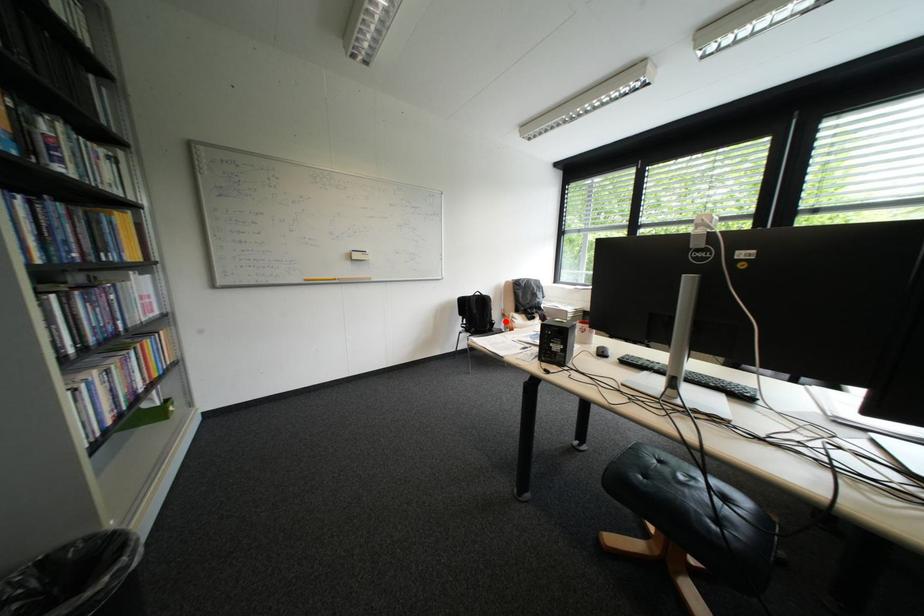
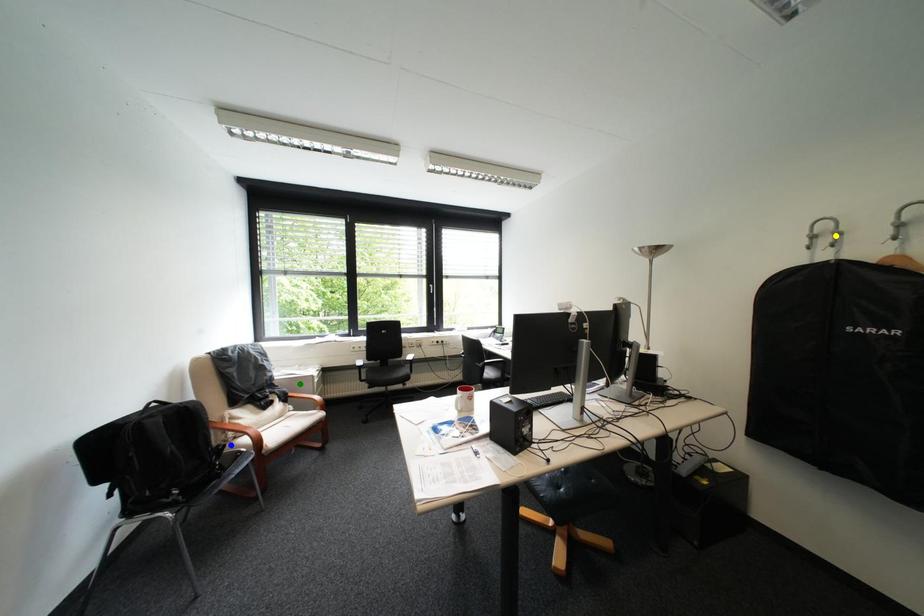
Question: I am providing you with two images of the same scene from different viewpoints. A red point is marked on the first image. You are given multiple points on the second image. Can you choose the point in image 2 that corresponds to the point in image 1?

Choices:
 (A) blue point
 (B) yellow point
 (C) green point

Answer: (A)